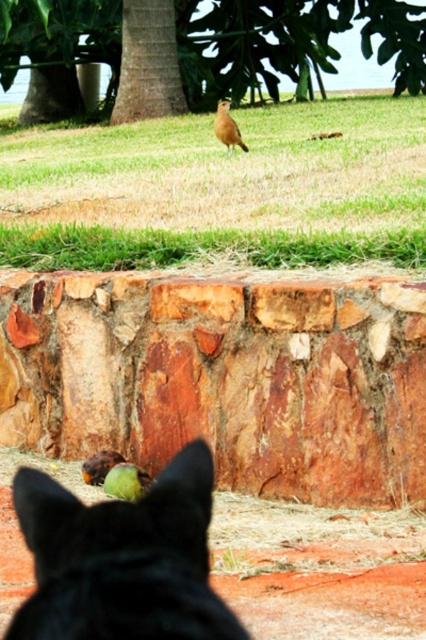
Question: Which point appears farthest from the camera in this image?

Choices:
 (A) (74, 611)
 (B) (230, 128)

Answer: (B)

Question: Which of the following is the farthest from the observer?

Choices:
 (A) (x=60, y=550)
 (B) (x=238, y=141)

Answer: (B)

Question: Estimate the real-world distances between objects in this image. Which object is closer to the green leafy tree at upper center?

Choices:
 (A) green grass at center
 (B) brown matte bird at upper center
 (C) black fur cat at center

Answer: (A)

Question: Is green grass at center closer to camera compared to brown matte bird at upper center?

Choices:
 (A) no
 (B) yes

Answer: (B)

Question: Can you confirm if green grass at center is wider than black fur cat at center?

Choices:
 (A) no
 (B) yes

Answer: (B)

Question: Is black fur cat at center to the left of brown matte bird at upper center from the viewer's perspective?

Choices:
 (A) no
 (B) yes

Answer: (B)